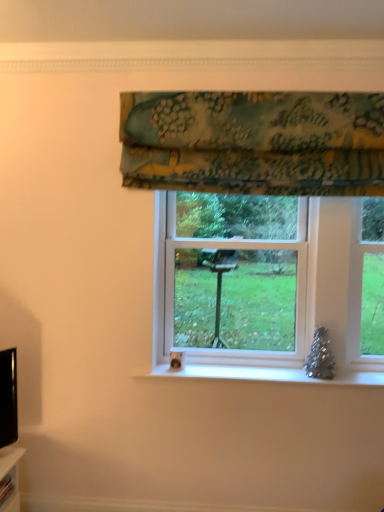
What do you see at coordinates (236, 278) in the screenshot? The width and height of the screenshot is (384, 512). I see `white plastic window at center` at bounding box center [236, 278].

Find the location of a particular element. white plastic window at center is located at coordinates (236, 278).

What do you see at coordinates (254, 142) in the screenshot? I see `textured floral fabric at upper center` at bounding box center [254, 142].

Image resolution: width=384 pixels, height=512 pixels. What are the coordinates of `textured floral fabric at upper center` in the screenshot? It's located at tap(254, 142).

What is the approximate height of textured floral fabric at upper center?

The height of textured floral fabric at upper center is 20.39 inches.

Locate an element on the screen. The image size is (384, 512). white plastic window at center is located at coordinates (236, 278).

In the image, is textured floral fabric at upper center on the left side or the right side of white plastic window at center?

From the image, it's evident that textured floral fabric at upper center is to the left of white plastic window at center.

Is textured floral fabric at upper center positioned in front of white plastic window at center?

That is True.

Considering the points (370, 186) and (209, 334), which point is in front, point (370, 186) or point (209, 334)?

Positioned in front is point (370, 186).

From the image's perspective, which object appears higher, textured floral fabric at upper center or white plastic window at center?

textured floral fabric at upper center.

From a real-world perspective, is textured floral fabric at upper center under white plastic window at center?

No.

Which object is thinner, textured floral fabric at upper center or white plastic window at center?

With smaller width is textured floral fabric at upper center.

Considering the sizes of objects textured floral fabric at upper center and white plastic window at center in the image provided, who is shorter, textured floral fabric at upper center or white plastic window at center?

Standing shorter between the two is textured floral fabric at upper center.

Considering the sizes of objects textured floral fabric at upper center and white plastic window at center in the image provided, who is bigger, textured floral fabric at upper center or white plastic window at center?

white plastic window at center is bigger.

Is textured floral fabric at upper center positioned beyond the bounds of white plastic window at center?

Absolutely, textured floral fabric at upper center is external to white plastic window at center.

Are textured floral fabric at upper center and white plastic window at center located far from each other?

No.

Is textured floral fabric at upper center positioned with its back to white plastic window at center?

No, textured floral fabric at upper center is not facing away from white plastic window at center.

Find the location of `bay window below the textured floral fabric at upper center (from a real-world perspective)`. bay window below the textured floral fabric at upper center (from a real-world perspective) is located at coordinates (236, 278).

Which object is positioned more to the right, white plastic window at center or textured floral fabric at upper center?

white plastic window at center is more to the right.

Which is behind, white plastic window at center or textured floral fabric at upper center?

Positioned behind is white plastic window at center.

Between point (272, 201) and point (300, 97), which one is positioned in front?

The point (300, 97) is closer.

From the image's perspective, is white plastic window at center on textured floral fabric at upper center?

No, from the image's perspective, white plastic window at center is not above textured floral fabric at upper center.

From a real-world perspective, is white plastic window at center positioned under textured floral fabric at upper center based on gravity?

Yes, from a real-world perspective, white plastic window at center is beneath textured floral fabric at upper center.

Is white plastic window at center wider than textured floral fabric at upper center?

Yes.

From their relative heights in the image, would you say white plastic window at center is taller or shorter than textured floral fabric at upper center?

Considering their sizes, white plastic window at center has more height than textured floral fabric at upper center.

Who is smaller, white plastic window at center or textured floral fabric at upper center?

textured floral fabric at upper center.

Is textured floral fabric at upper center completely or partially inside white plastic window at center?

That's incorrect, textured floral fabric at upper center is not inside white plastic window at center.

Are white plastic window at center and textured floral fabric at upper center located far from each other?

No, white plastic window at center is not far away from textured floral fabric at upper center.

Is white plastic window at center turned away from textured floral fabric at upper center?

No, white plastic window at center is not facing the opposite direction of textured floral fabric at upper center.

Can you tell me how much white plastic window at center and textured floral fabric at upper center differ in facing direction?

There is a 0.797-degree angle between the facing directions of white plastic window at center and textured floral fabric at upper center.

From the picture: How distant is white plastic window at center from textured floral fabric at upper center?

19.48 inches.

At what (x,y) coordinates should I click in order to perform the action: click on curtain above the white plastic window at center (from the image's perspective). Please return your answer as a coordinate pair (x, y). Looking at the image, I should click on (254, 142).

Where is `bay window located on the right of textured floral fabric at upper center`? bay window located on the right of textured floral fabric at upper center is located at coordinates (236, 278).

Where is `curtain above the white plastic window at center (from a real-world perspective)`? Image resolution: width=384 pixels, height=512 pixels. curtain above the white plastic window at center (from a real-world perspective) is located at coordinates (254, 142).